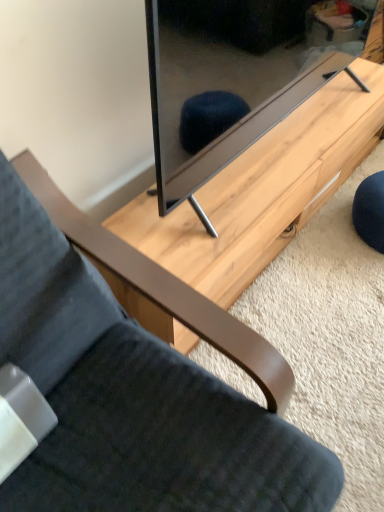
Question: Does matte black tv at center lie behind velvet dark gray chair at lower left?

Choices:
 (A) yes
 (B) no

Answer: (A)

Question: Would you consider matte black tv at center to be distant from velvet dark gray chair at lower left?

Choices:
 (A) yes
 (B) no

Answer: (B)

Question: Can you confirm if matte black tv at center is bigger than velvet dark gray chair at lower left?

Choices:
 (A) no
 (B) yes

Answer: (A)

Question: Is matte black tv at center facing away from velvet dark gray chair at lower left?

Choices:
 (A) yes
 (B) no

Answer: (B)

Question: From a real-world perspective, is matte black tv at center physically above velvet dark gray chair at lower left?

Choices:
 (A) yes
 (B) no

Answer: (A)

Question: In the image, is matte black tv at center positioned in front of or behind light wood table at center?

Choices:
 (A) front
 (B) behind

Answer: (A)

Question: From the image's perspective, is matte black tv at center positioned above or below light wood table at center?

Choices:
 (A) below
 (B) above

Answer: (B)

Question: Is matte black tv at center inside the boundaries of light wood table at center, or outside?

Choices:
 (A) outside
 (B) inside

Answer: (A)

Question: Is matte black tv at center wider or thinner than light wood table at center?

Choices:
 (A) thin
 (B) wide

Answer: (A)

Question: Is light wood table at center to the left or to the right of velvet dark gray chair at lower left in the image?

Choices:
 (A) right
 (B) left

Answer: (A)

Question: In terms of width, does light wood table at center look wider or thinner when compared to velvet dark gray chair at lower left?

Choices:
 (A) thin
 (B) wide

Answer: (A)

Question: Is light wood table at center situated inside velvet dark gray chair at lower left or outside?

Choices:
 (A) inside
 (B) outside

Answer: (B)

Question: Is light wood table at center in front of or behind velvet dark gray chair at lower left in the image?

Choices:
 (A) front
 (B) behind

Answer: (B)

Question: Which is correct: matte black tv at center is inside velvet dark gray chair at lower left, or outside of it?

Choices:
 (A) outside
 (B) inside

Answer: (A)

Question: From the image's perspective, is matte black tv at center located above or below velvet dark gray chair at lower left?

Choices:
 (A) above
 (B) below

Answer: (A)